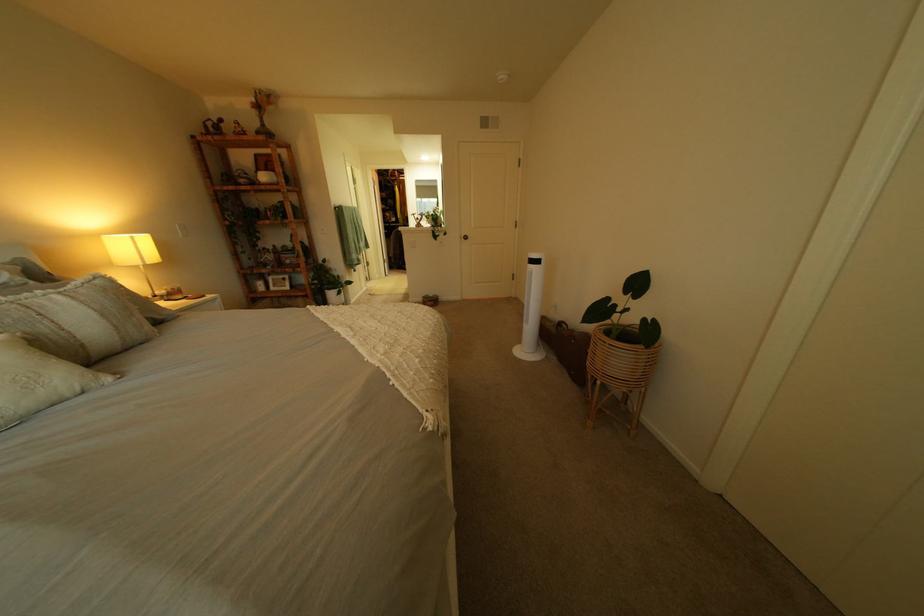
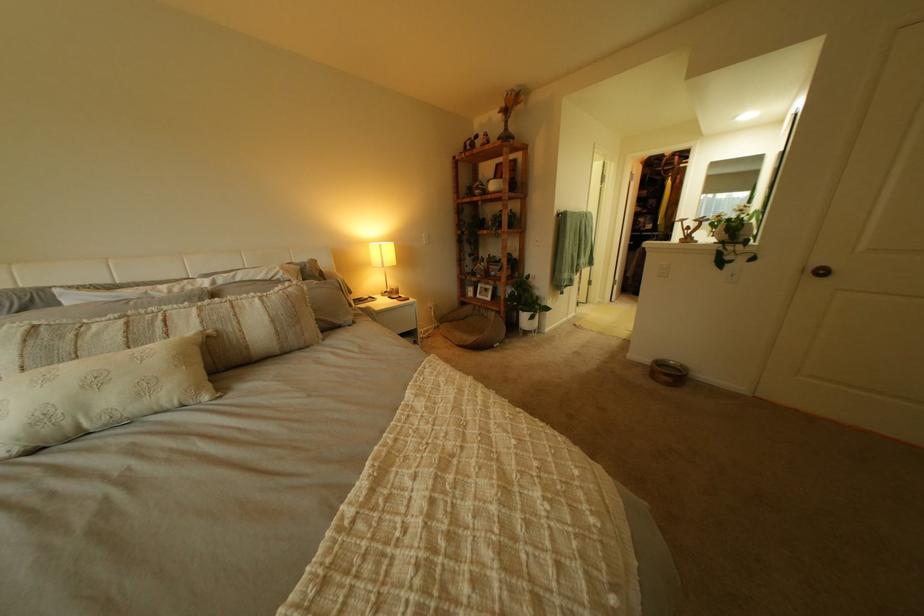
Find the pixel in the second image that matches [435,301] in the first image.

(663, 362)